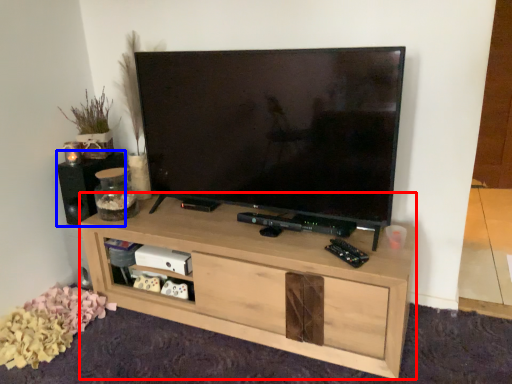
Question: Which point is closer to the camera, shelf (highlighted by a red box) or speaker (highlighted by a blue box)?

Choices:
 (A) shelf
 (B) speaker

Answer: (A)